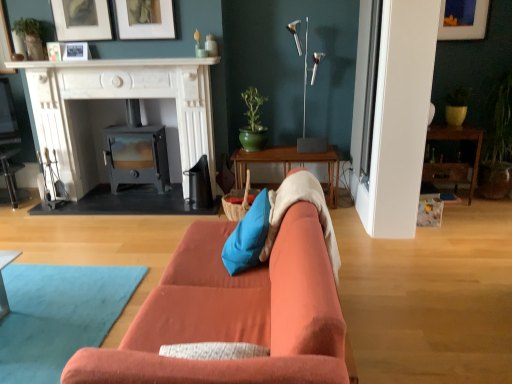
Question: Considering the relative sizes of matte white picture frame at upper right, which is counted as the fifth picture frame, starting from the left, and white marble fireplace at upper center in the image provided, is matte white picture frame at upper right, which is counted as the fifth picture frame, starting from the left, smaller than white marble fireplace at upper center?

Choices:
 (A) no
 (B) yes

Answer: (B)

Question: From a real-world perspective, is matte white picture frame at upper right, which is counted as the fifth picture frame, starting from the left, beneath white marble fireplace at upper center?

Choices:
 (A) yes
 (B) no

Answer: (B)

Question: Is matte white picture frame at upper right, placed as the first picture frame when sorted from right to left, placed right next to white marble fireplace at upper center?

Choices:
 (A) no
 (B) yes

Answer: (A)

Question: Is matte white picture frame at upper right, placed as the first picture frame when sorted from right to left, wider than white marble fireplace at upper center?

Choices:
 (A) yes
 (B) no

Answer: (B)

Question: Is matte white picture frame at upper right, which is counted as the fifth picture frame, starting from the left, shorter than white marble fireplace at upper center?

Choices:
 (A) yes
 (B) no

Answer: (B)

Question: Considering the relative positions of matte white picture frame at upper center, which ranks as the fourth picture frame in left-to-right order, and wooden shelf at right, marked as the 2th table in a left-to-right arrangement, in the image provided, is matte white picture frame at upper center, which ranks as the fourth picture frame in left-to-right order, to the left or to the right of wooden shelf at right, marked as the 2th table in a left-to-right arrangement,?

Choices:
 (A) right
 (B) left

Answer: (B)

Question: Considering the positions of point (174, 33) and point (459, 134), is point (174, 33) closer or farther from the camera than point (459, 134)?

Choices:
 (A) closer
 (B) farther

Answer: (A)

Question: Which is correct: matte white picture frame at upper center, positioned as the 2th picture frame in right-to-left order, is inside wooden shelf at right, which is the 1th table from right to left, or outside of it?

Choices:
 (A) inside
 (B) outside

Answer: (B)

Question: Considering the positions of matte white picture frame at upper center, which ranks as the fourth picture frame in left-to-right order, and wooden shelf at right, marked as the 2th table in a left-to-right arrangement, in the image, is matte white picture frame at upper center, which ranks as the fourth picture frame in left-to-right order, taller or shorter than wooden shelf at right, marked as the 2th table in a left-to-right arrangement,?

Choices:
 (A) tall
 (B) short

Answer: (B)

Question: From a real-world perspective, is white marble fireplace at upper center positioned above or below matte white picture frame at upper left, which is counted as the first picture frame, starting from the left?

Choices:
 (A) above
 (B) below

Answer: (B)

Question: In terms of width, does white marble fireplace at upper center look wider or thinner when compared to matte white picture frame at upper left, which ranks as the 5th picture frame in right-to-left order?

Choices:
 (A) thin
 (B) wide

Answer: (B)

Question: Is white marble fireplace at upper center taller or shorter than matte white picture frame at upper left, which ranks as the 5th picture frame in right-to-left order?

Choices:
 (A) short
 (B) tall

Answer: (A)

Question: Based on their sizes in the image, would you say white marble fireplace at upper center is bigger or smaller than matte white picture frame at upper left, which ranks as the 5th picture frame in right-to-left order?

Choices:
 (A) big
 (B) small

Answer: (A)

Question: In terms of width, does metallic gray wood burning stove at center look wider or thinner when compared to orange fabric couch at center?

Choices:
 (A) thin
 (B) wide

Answer: (A)

Question: Considering their positions, is metallic gray wood burning stove at center located in front of or behind orange fabric couch at center?

Choices:
 (A) front
 (B) behind

Answer: (B)